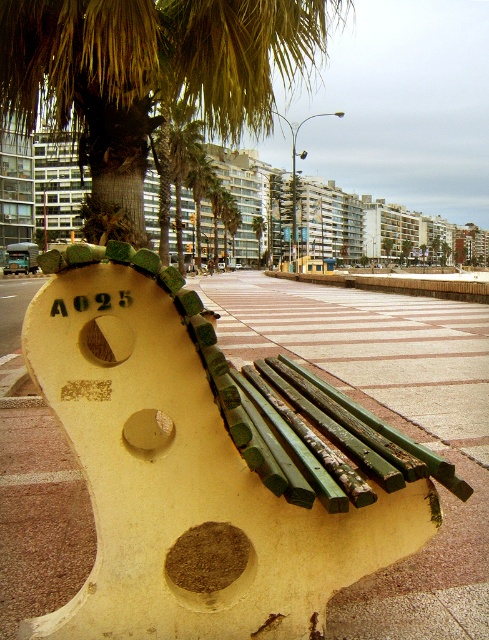
Is green leafy palm tree at center shorter than brown dirt at center?

In fact, green leafy palm tree at center may be taller than brown dirt at center.

Is green leafy palm tree at center positioned in front of brown dirt at center?

No, it is not.

Who is more forward, (164,212) or (214,584)?

Positioned in front is point (214,584).

Image resolution: width=489 pixels, height=640 pixels. Find the location of `green leafy palm tree at center`. green leafy palm tree at center is located at coordinates (176, 168).

In the scene shown: How far apart are smooth concrete bench at center and green leafy palm tree at center?

smooth concrete bench at center is 8.60 meters away from green leafy palm tree at center.

Between smooth concrete bench at center and green leafy palm tree at center, which one is positioned lower?

Positioned lower is smooth concrete bench at center.

I want to click on smooth concrete bench at center, so click(387, 410).

Locate an element on the screen. smooth concrete bench at center is located at coordinates (387, 410).

Is green leafy palm tree at upper center smaller than brown dirt at center?

Incorrect, green leafy palm tree at upper center is not smaller in size than brown dirt at center.

Find the location of a particular element. This screenshot has width=489, height=640. green leafy palm tree at upper center is located at coordinates (153, 72).